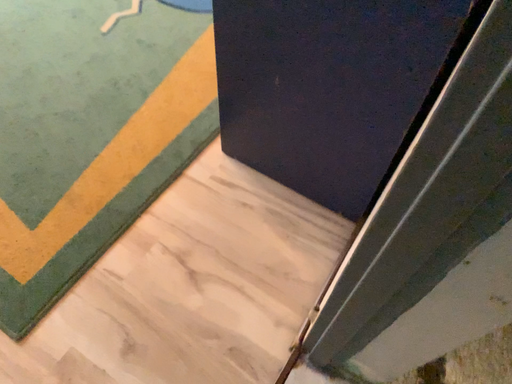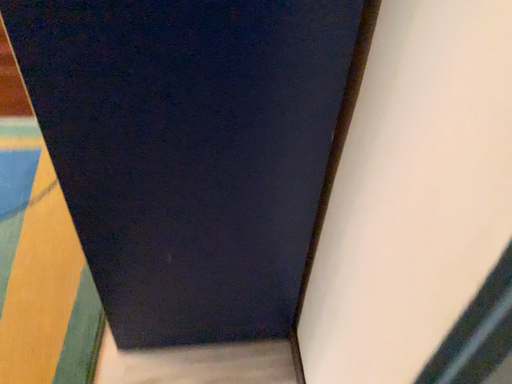
Question: Which way did the camera rotate in the video?

Choices:
 (A) rotated right
 (B) rotated left

Answer: (A)